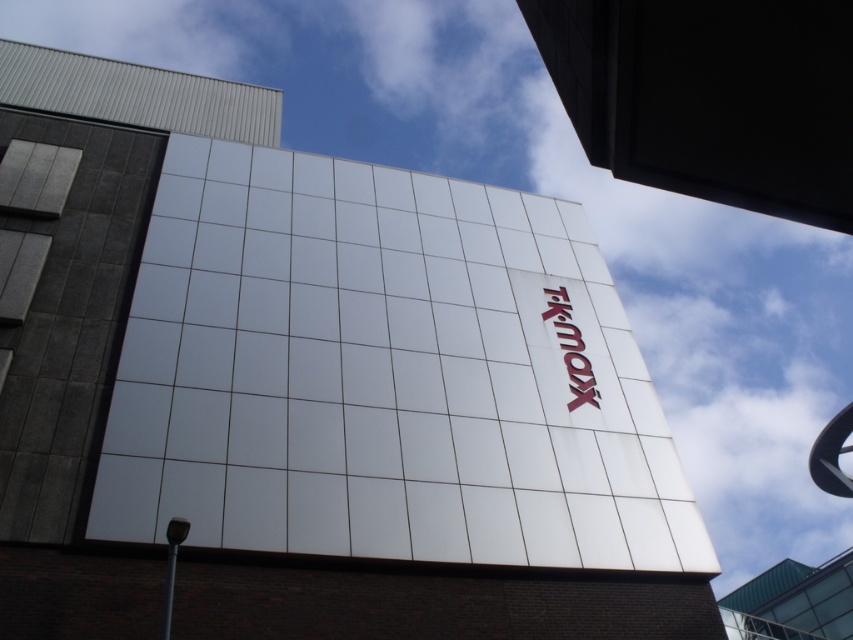
Who is more distant from viewer, [660,86] or [555,308]?

The point [555,308] is more distant.

Who is positioned more to the left, white glossy sign at upper center or red glossy sign at upper center?

From the viewer's perspective, white glossy sign at upper center appears more on the left side.

Which is behind, point (811, 160) or point (566, 323)?

The point (566, 323) is behind.

Where is `white glossy sign at upper center`? white glossy sign at upper center is located at coordinates (711, 97).